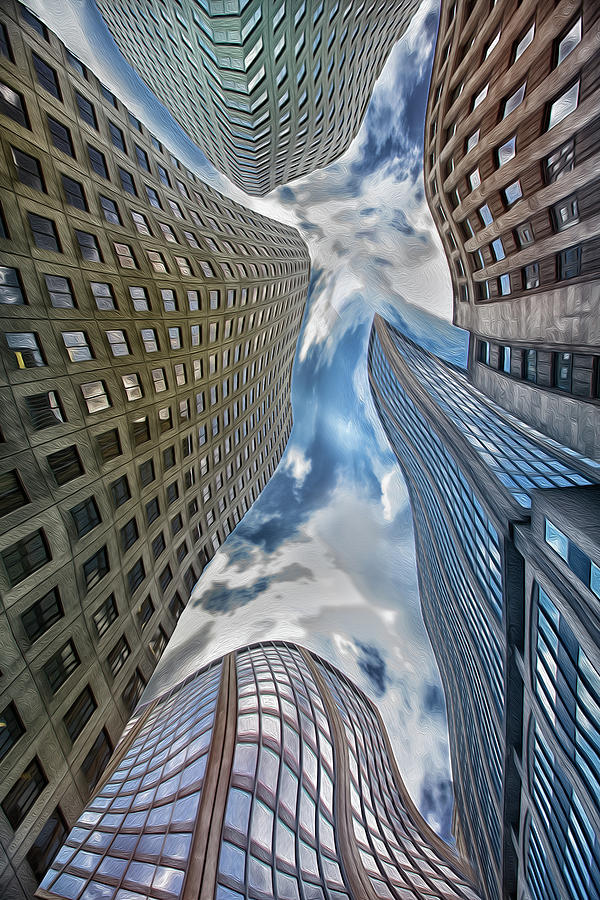
This screenshot has width=600, height=900. Find the location of `middle section lowest window`. middle section lowest window is located at coordinates (223, 891).